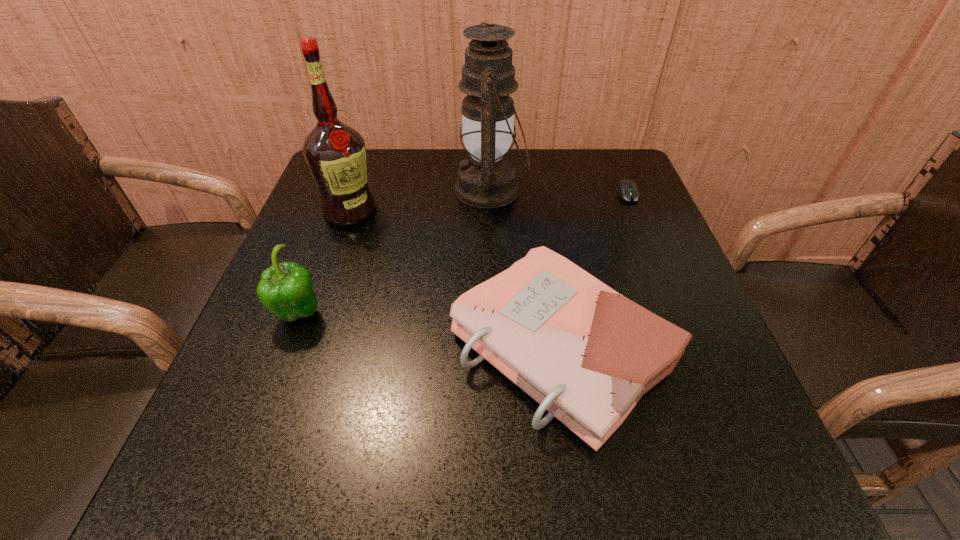
Identify the location of object present at the near right corner. (587, 354).

Where is `vacant space at the far edge`? The width and height of the screenshot is (960, 540). vacant space at the far edge is located at coordinates [425, 175].

Locate an element on the screen. The image size is (960, 540). vacant space at the near edge of the desktop is located at coordinates (347, 494).

This screenshot has height=540, width=960. In the image, there is a desktop. Find the location of `vacant space at the left edge`. vacant space at the left edge is located at coordinates (311, 432).

The image size is (960, 540). In order to click on blank space at the right edge of the desktop in this screenshot , I will do `click(740, 399)`.

In order to click on free space at the near left corner in this screenshot , I will do `click(197, 484)`.

Identify the location of vacant point located between the bell pepper and the computer mouse. (463, 254).

Where is `free area in between the bell pepper and the computer mouse`? This screenshot has height=540, width=960. free area in between the bell pepper and the computer mouse is located at coordinates (463, 254).

Where is `vacant space that's between the bell pepper and the shortest object`? This screenshot has width=960, height=540. vacant space that's between the bell pepper and the shortest object is located at coordinates (463, 254).

The width and height of the screenshot is (960, 540). I want to click on empty location between the computer mouse and the oil lamp, so click(559, 191).